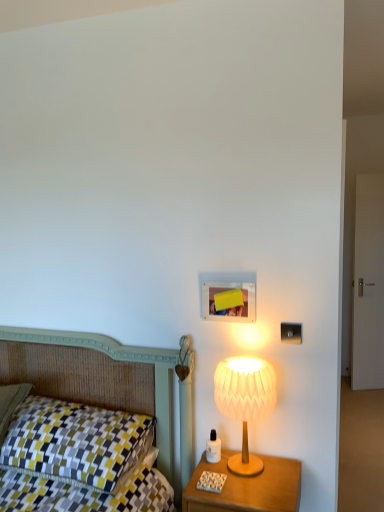
This screenshot has width=384, height=512. In order to click on vacant space situated above wooden nightstand at right (from a real-world perspective) in this screenshot , I will do `click(244, 475)`.